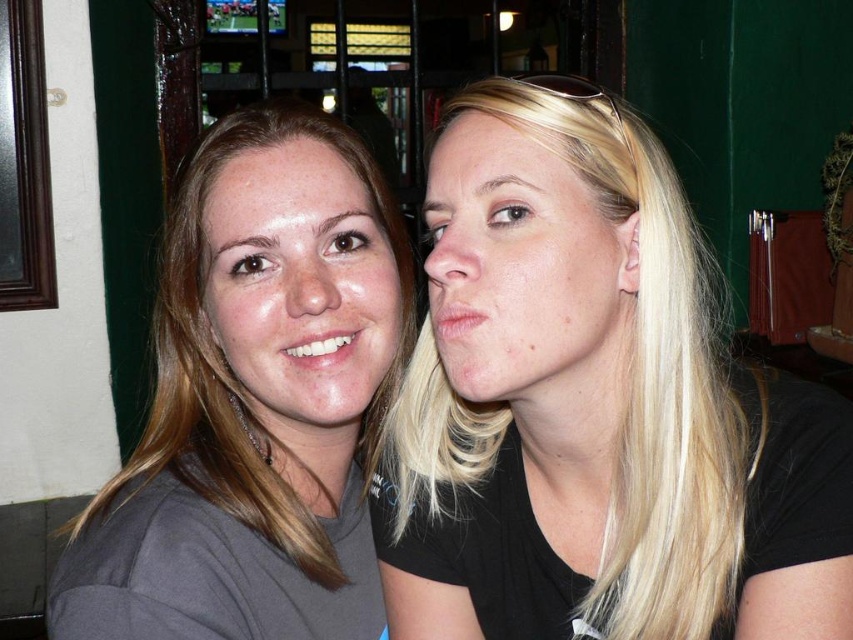
In the scene shown: You are standing in a room and see two people sitting near a window. The person on the left has brown hair and is wearing a gray T shirt. The person on the right has blonde hair and is wearing a black T shirt. There is a point marked at coordinate (x=595, y=406). Can you tell me where the blonde hair is located relative to this point?

The blonde hair at center is represented by point (x=595, y=406), so the point is exactly where the blonde hair at center is located.

Based on the photo, you are a photographer trying to capture a closeup of both the blonde hair at center and the matte gray shirt at left. Since you want to focus on the details of the hair and the shirt, which one should you adjust your camera focus to prioritize first?

The blonde hair at center is shorter than the matte gray shirt at left, so you should prioritize focusing on the matte gray shirt at left first because it is farther away and requires a different focal plane.

You are a photographer trying to capture a candid shot of the smooth skin face at right and the blonde hair at center. Since you can only focus on one subject at a time, which one should you focus on to ensure the other appears in the background?

You should focus on the smooth skin face at right because the blonde hair at center is to the right of it, meaning the face is closer to the camera and the hair would naturally be in the background.